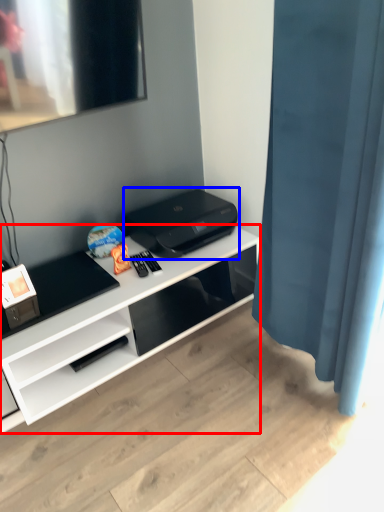
Question: Which object is further to the camera taking this photo, desk (highlighted by a red box) or printer (highlighted by a blue box)?

Choices:
 (A) desk
 (B) printer

Answer: (B)